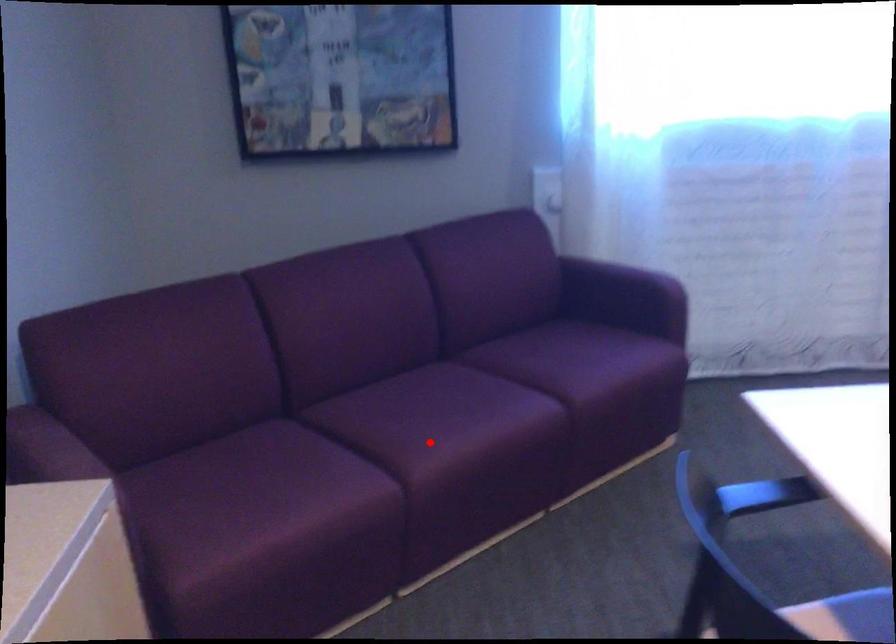
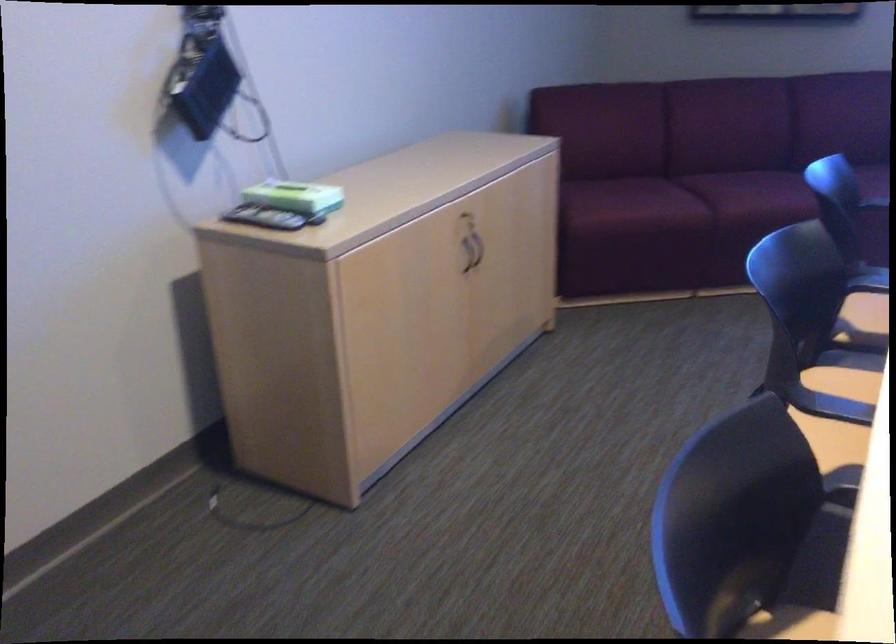
Question: I am providing you with two images of the same scene from different viewpoints. Given a red point in image1, look at the same physical point in image2. Is it:

Choices:
 (A) Closer to the viewpoint
 (B) Farther from the viewpoint

Answer: (B)